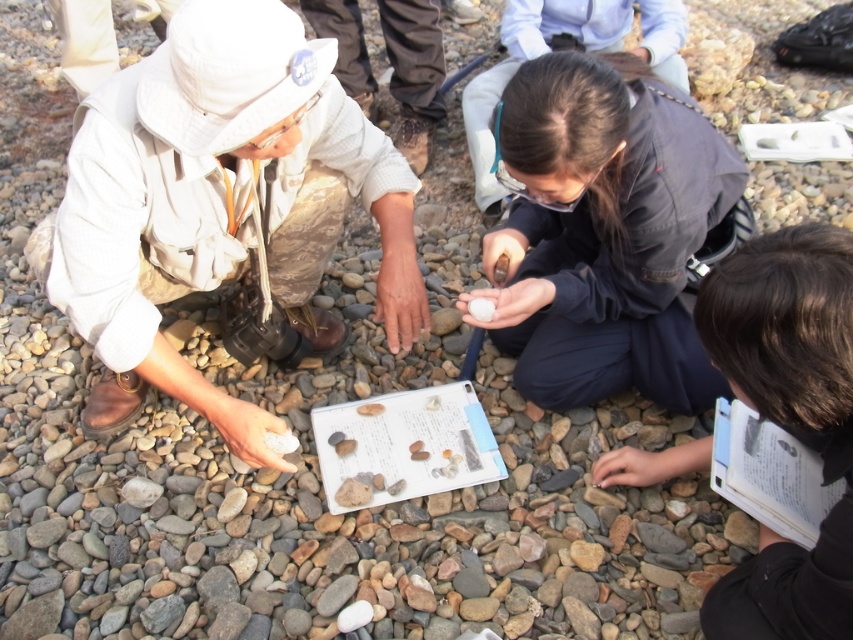
Question: Can you confirm if matte beige hat at upper left is positioned above dark blue fabric at center?

Choices:
 (A) no
 (B) yes

Answer: (A)

Question: Which point appears farthest from the camera in this image?

Choices:
 (A) (77, 161)
 (B) (772, 282)
 (C) (704, 189)

Answer: (C)

Question: Estimate the real-world distances between objects in this image. Which object is closer to the dark blue fabric at center?

Choices:
 (A) black matte book at lower right
 (B) matte beige hat at upper left

Answer: (A)

Question: Does dark blue fabric at center have a smaller size compared to black matte book at lower right?

Choices:
 (A) no
 (B) yes

Answer: (A)

Question: Which of the following is the farthest from the observer?

Choices:
 (A) dark blue fabric at center
 (B) black matte book at lower right

Answer: (A)

Question: Is matte beige hat at upper left positioned at the back of black matte book at lower right?

Choices:
 (A) yes
 (B) no

Answer: (A)